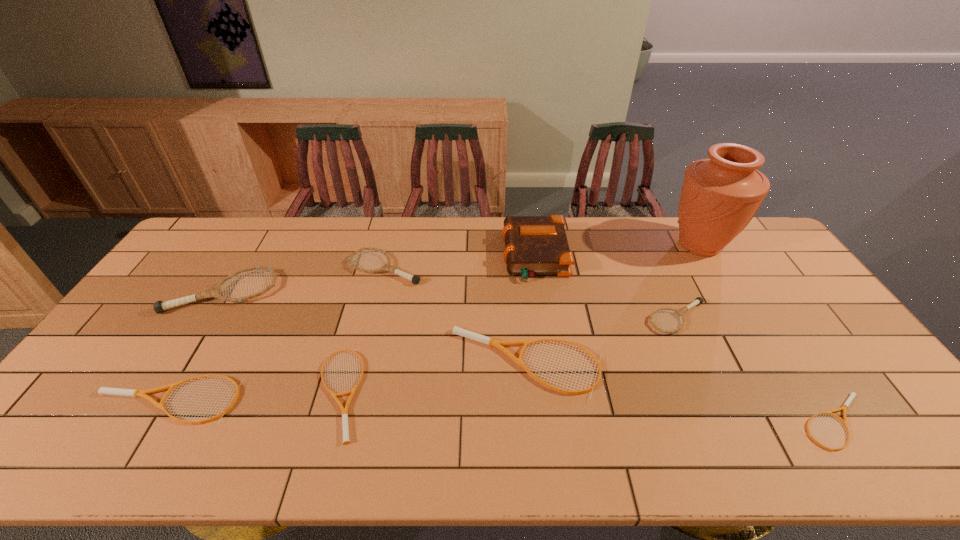
Identify the location of tennis racket located at the far edge. The width and height of the screenshot is (960, 540). (415, 279).

Find the location of a particular element. This screenshot has height=540, width=960. vase situated at the right edge is located at coordinates (720, 195).

Locate an element on the screen. tennis racket present at the right edge is located at coordinates (852, 394).

Locate an element on the screen. The image size is (960, 540). object that is at the far right corner is located at coordinates tap(720, 195).

At what (x,y) coordinates should I click in order to perform the action: click on object that is at the near right corner. Please return your answer as a coordinate pair (x, y). Image resolution: width=960 pixels, height=540 pixels. Looking at the image, I should click on (852, 394).

At what (x,y) coordinates should I click in order to perform the action: click on vacant position at the far edge of the desktop. Please return your answer as a coordinate pair (x, y). The image size is (960, 540). Looking at the image, I should click on (430, 219).

Find the location of a particular element. free space at the near edge of the desktop is located at coordinates (287, 435).

Image resolution: width=960 pixels, height=540 pixels. I want to click on vacant space at the left edge, so click(118, 409).

In the image, there is a desktop. Identify the location of free space at the right edge. (754, 271).

Identify the location of vacant space at the far left corner of the desktop. (210, 220).